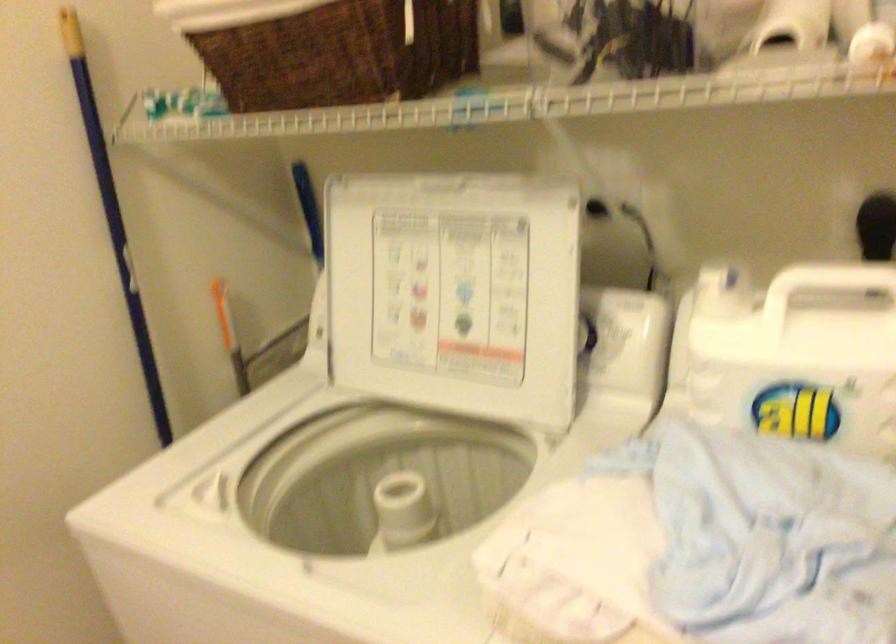
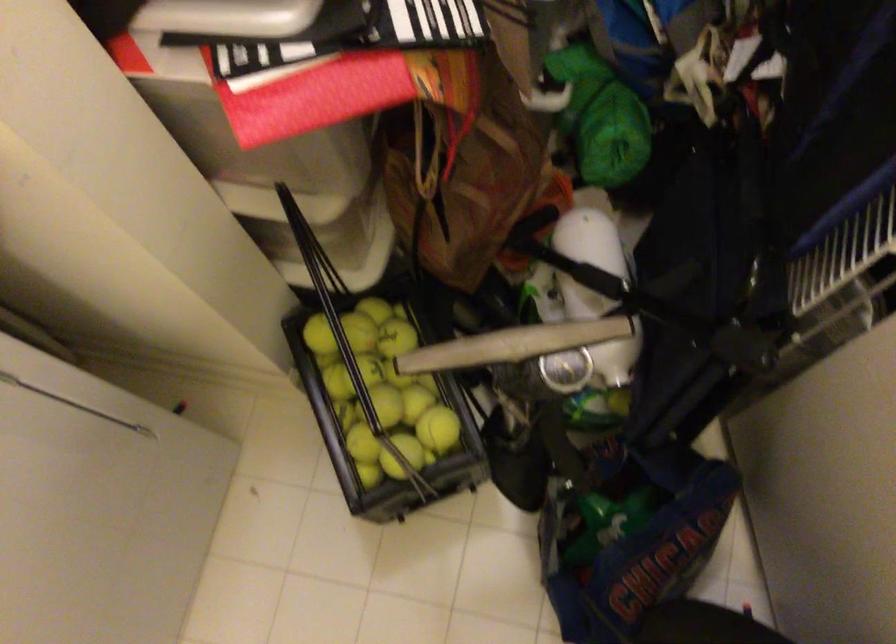
First-person continuous shooting, in which direction is the camera rotating?

The rotation direction of the camera is right-down.